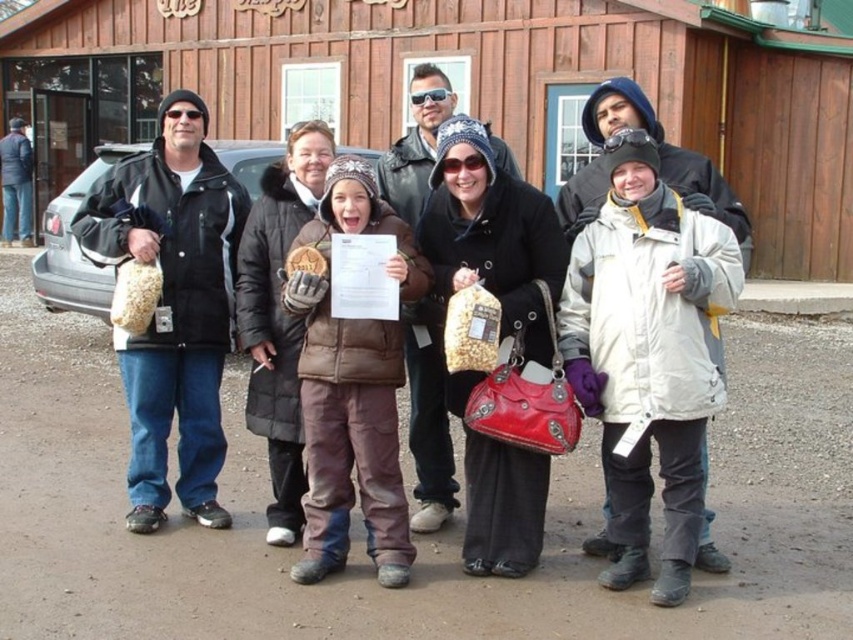
Is wooden hut at center thinner than brown fuzzy jacket at center?

In fact, wooden hut at center might be wider than brown fuzzy jacket at center.

Does wooden hut at center have a greater height compared to brown fuzzy jacket at center?

Indeed, wooden hut at center has a greater height compared to brown fuzzy jacket at center.

Image resolution: width=853 pixels, height=640 pixels. What do you see at coordinates (491, 83) in the screenshot?
I see `wooden hut at center` at bounding box center [491, 83].

At what (x,y) coordinates should I click in order to perform the action: click on wooden hut at center. Please return your answer as a coordinate pair (x, y). Image resolution: width=853 pixels, height=640 pixels. Looking at the image, I should click on (491, 83).

Which of these two, wooden hut at center or matte black jacket at left, stands shorter?

matte black jacket at left

Between wooden hut at center and matte black jacket at left, which one appears on the left side from the viewer's perspective?

Positioned to the left is matte black jacket at left.

Find the location of `wooden hut at center`. wooden hut at center is located at coordinates (491, 83).

The height and width of the screenshot is (640, 853). In order to click on wooden hut at center in this screenshot , I will do `click(491, 83)`.

Is matte black jacket at left shorter than brown fuzzy jacket at center?

In fact, matte black jacket at left may be taller than brown fuzzy jacket at center.

Where is `matte black jacket at left`? matte black jacket at left is located at coordinates (172, 305).